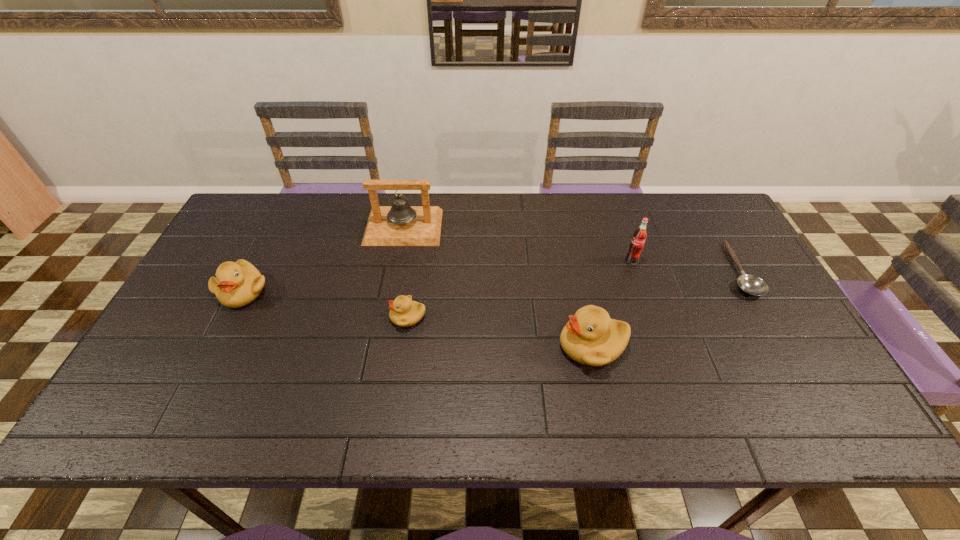
The height and width of the screenshot is (540, 960). In order to click on object that is at the near edge in this screenshot , I will do `click(590, 337)`.

This screenshot has width=960, height=540. In order to click on object at the left edge in this screenshot , I will do `click(236, 284)`.

Find the location of a particular element. Image resolution: width=960 pixels, height=540 pixels. object located at the right edge is located at coordinates (750, 284).

This screenshot has height=540, width=960. In the image, there is a desktop. What are the coordinates of `blank space at the far edge` in the screenshot? It's located at (660, 217).

This screenshot has height=540, width=960. Identify the location of free spot at the near edge of the desktop. (570, 368).

Where is `free space at the left edge of the desktop`? The image size is (960, 540). free space at the left edge of the desktop is located at coordinates click(x=220, y=330).

Find the location of `free space at the right edge`. free space at the right edge is located at coordinates (717, 262).

I want to click on vacant space at the far left corner, so click(x=251, y=217).

Identify the location of free area in between the soda bottle and the second duckling from left to right. (520, 289).

In order to click on free spot between the fifth object from left to right and the bell in this screenshot , I will do `click(517, 244)`.